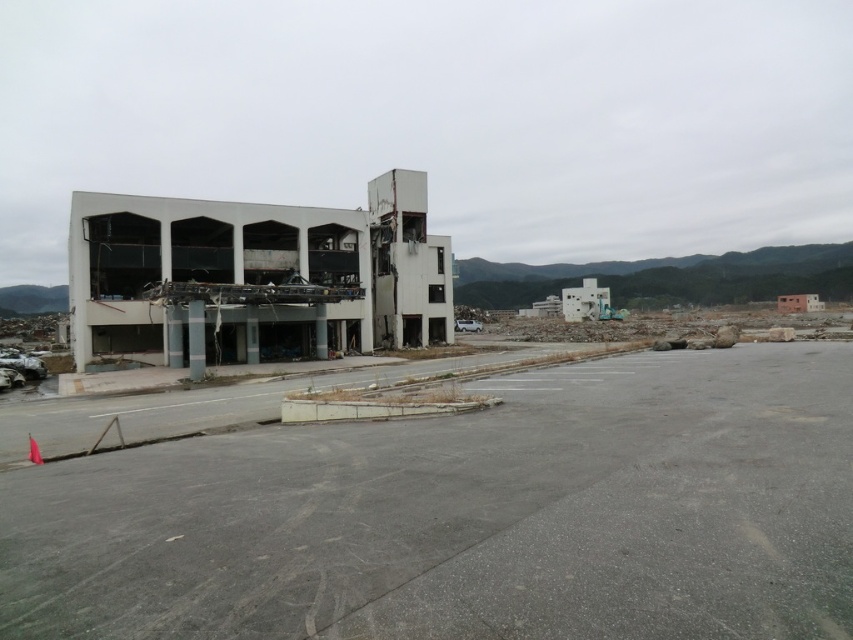
Question: Which point appears farthest from the camera in this image?

Choices:
 (A) (728, 515)
 (B) (144, 243)

Answer: (B)

Question: Which object is closer to the camera taking this photo?

Choices:
 (A) white concrete building at left
 (B) white concrete building at center

Answer: (A)

Question: Is the position of white concrete building at left more distant than that of white concrete building at center?

Choices:
 (A) yes
 (B) no

Answer: (B)

Question: Can you confirm if white concrete building at left is positioned to the right of white concrete building at center?

Choices:
 (A) no
 (B) yes

Answer: (B)

Question: Can you confirm if white concrete building at left is positioned to the left of white concrete building at center?

Choices:
 (A) no
 (B) yes

Answer: (A)